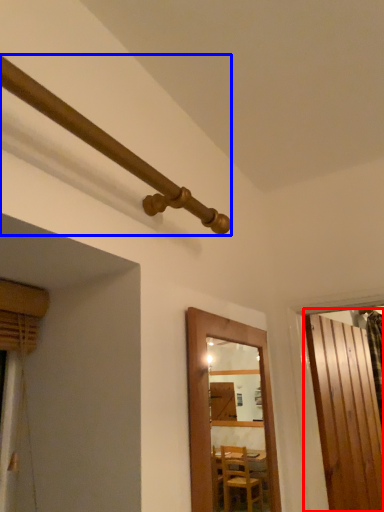
Question: Which object is closer to the camera taking this photo, door (highlighted by a red box) or pipe (highlighted by a blue box)?

Choices:
 (A) door
 (B) pipe

Answer: (B)